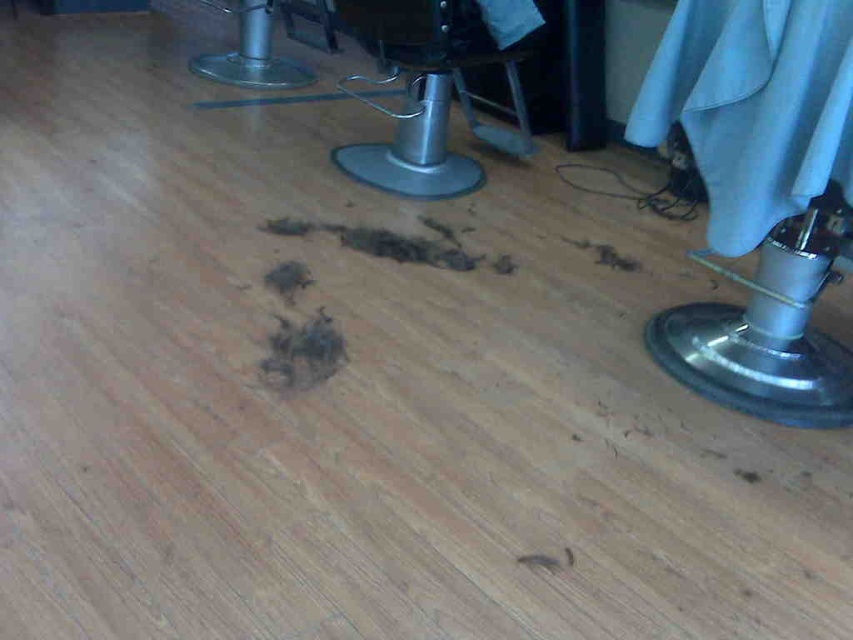
Does dark brown fur at center have a lesser height compared to brown fur at center?

In fact, dark brown fur at center may be taller than brown fur at center.

Who is positioned more to the left, dark brown fur at center or brown fur at center?

brown fur at center is more to the left.

The width and height of the screenshot is (853, 640). In order to click on dark brown fur at center in this screenshot , I will do `click(302, 353)`.

Can you confirm if metallic silver chair at center is positioned below brown fur at center?

No, metallic silver chair at center is not below brown fur at center.

Who is more distant from viewer, (341, 3) or (276, 292)?

The point (341, 3) is more distant.

Between point (413, 84) and point (274, 288), which one is positioned behind?

Point (413, 84)

Locate an element on the screen. This screenshot has height=640, width=853. metallic silver chair at center is located at coordinates (421, 92).

Can you confirm if metallic silver chair at center is taller than dark brown fur at center?

Indeed, metallic silver chair at center has a greater height compared to dark brown fur at center.

Who is positioned more to the left, metallic silver chair at center or dark brown fur at center?

Positioned to the left is dark brown fur at center.

Who is more forward, (465,20) or (300,348)?

Positioned in front is point (300,348).

In order to click on metallic silver chair at center in this screenshot , I will do `click(421, 92)`.